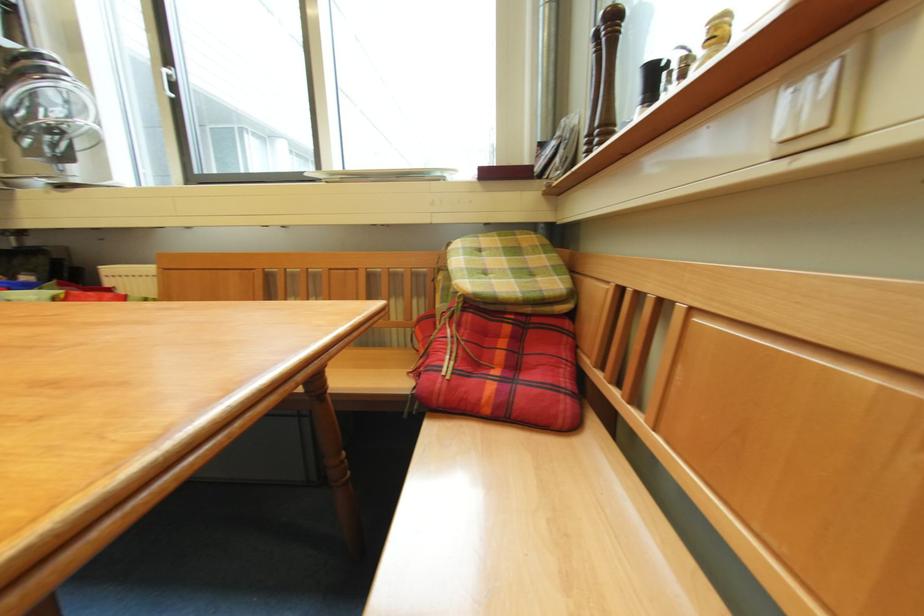
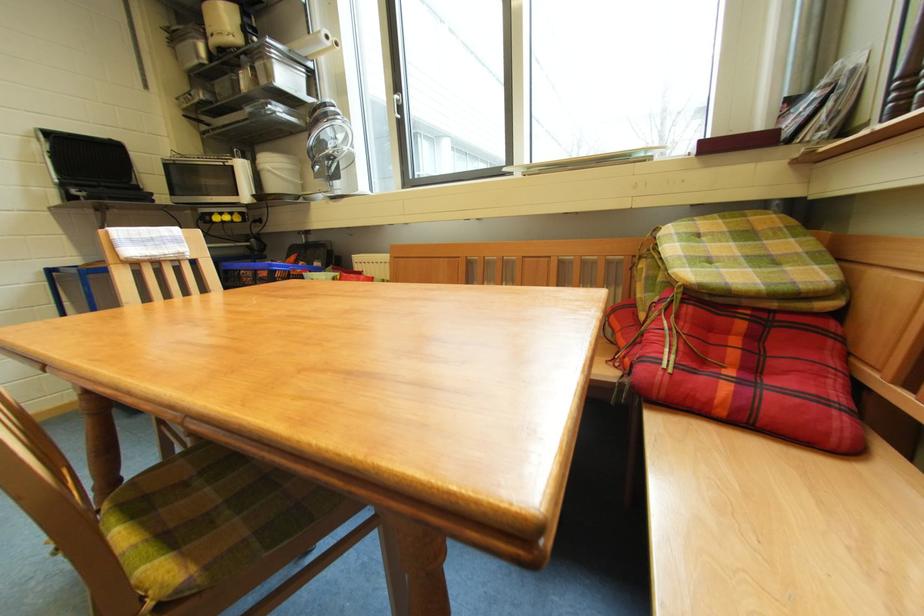
Find the pixel in the second image that matches pixel 580 437 in the first image.

(864, 463)